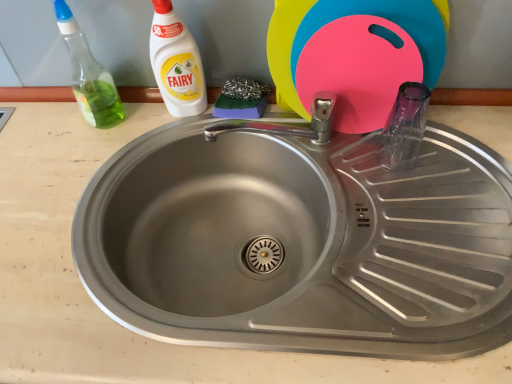
The image size is (512, 384). I want to click on vacant space situated on the left part of green translucent spray bottle at left, which is counted as the first cleaning product, starting from the left, so click(44, 128).